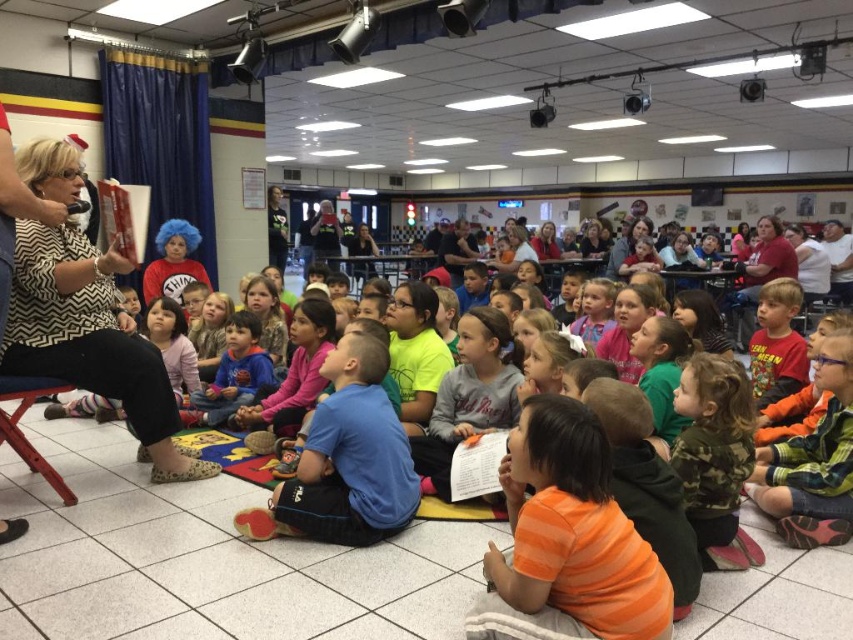
You are a photographer standing at the back of the room. You want to take a photo of the patterned fabric shirt at left and ensure that it is in focus while keeping the woman reading the book blurry. Can you do this with a camera that has a depth of field of 2 meters?

The patterned fabric shirt at left and the woman reading the book are 2.82 meters apart. Since the depth of field is 2 meters, the camera cannot keep both in focus. Therefore, you can focus on the patterned fabric shirt at left and have the woman blurry.

You are a child sitting at point (97,372) and want to reach the snack table located at point (195,410). Is there a clear path between these two points without needing to go around any obstacles?

Point (97,372) is in front of point (195,410), so there is a clear path between them without needing to go around obstacles.

You are a photographer trying to capture a photo of the children. You want to focus on the orange cotton shirt at center and the blue fleece jacket at center. Which one should you adjust your camera to focus on first if you want to ensure both are in the frame?

The orange cotton shirt at center is in front of the blue fleece jacket at center, so you should focus on the orange cotton shirt at center first to ensure both are in the frame.